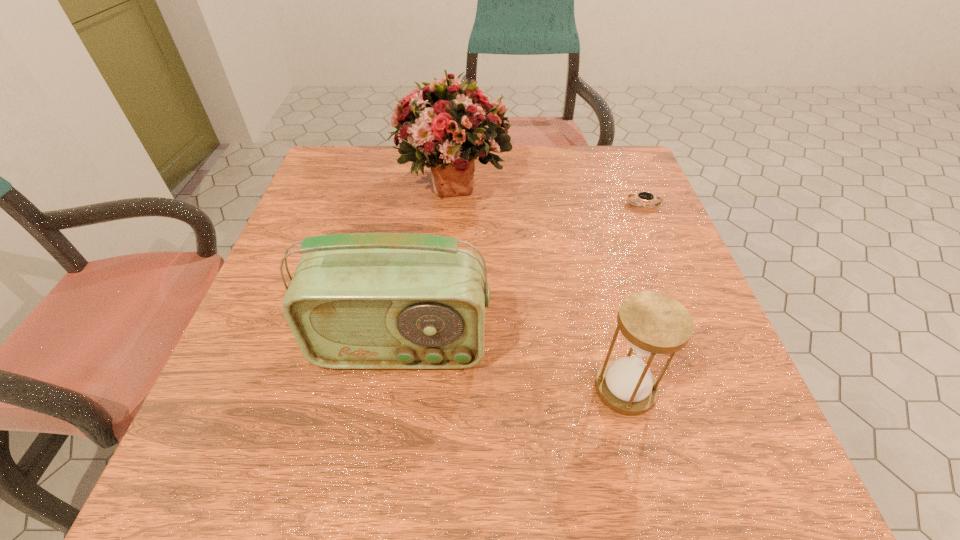
What are the coordinates of `vacant space in between the hourglass and the radio receiver` in the screenshot? It's located at (513, 368).

Image resolution: width=960 pixels, height=540 pixels. I want to click on free space between the radio receiver and the shortest object, so click(522, 276).

This screenshot has width=960, height=540. Identify the location of free space between the bouquet and the third tallest object. (539, 285).

Where is `vacant area that lies between the bouquet and the shortest object`? vacant area that lies between the bouquet and the shortest object is located at coordinates (548, 193).

Locate an element on the screen. vacant point located between the hourglass and the bouquet is located at coordinates (539, 285).

You are a GUI agent. You are given a task and a screenshot of the screen. Output one action in this format:
    pyautogui.click(x=<x>, y=<y>)
    Task: Click on the free space that is in between the shortest object and the radio receiver
    The width and height of the screenshot is (960, 540).
    Given the screenshot: What is the action you would take?
    pyautogui.click(x=522, y=276)

The width and height of the screenshot is (960, 540). I want to click on vacant region between the watch and the bouquet, so click(x=548, y=193).

Identify which object is located as the nearest to the radio receiver. Please provide its 2D coordinates. Your answer should be formatted as a tuple, i.e. [(x, y)], where the tuple contains the x and y coordinates of a point satisfying the conditions above.

[(653, 323)]

Choose which object is the second nearest neighbor to the bouquet. Please provide its 2D coordinates. Your answer should be formatted as a tuple, i.e. [(x, y)], where the tuple contains the x and y coordinates of a point satisfying the conditions above.

[(379, 300)]

This screenshot has height=540, width=960. I want to click on free spot that satisfies the following two spatial constraints: 1. on the back side of the shortest object; 2. on the left side of the hourglass, so click(x=579, y=206).